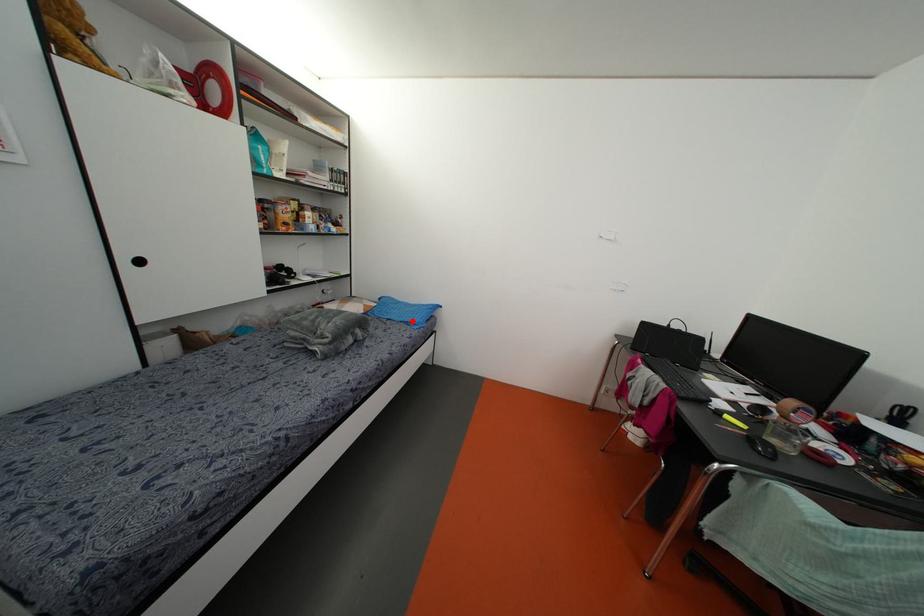
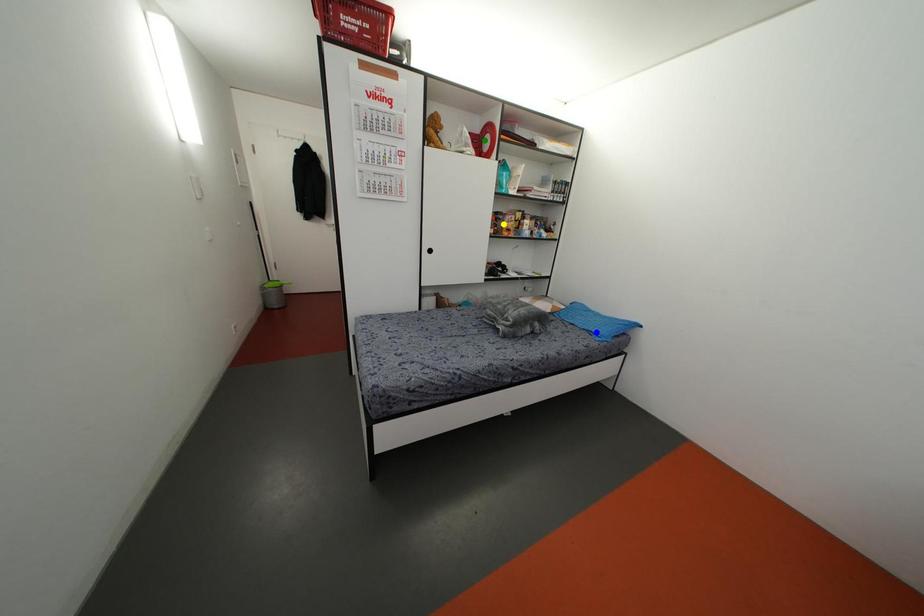
Question: I am providing you with two images of the same scene from different viewpoints. A red point is marked on the first image. You are given multiple points on the second image. Which mark in image 2 goes with the point in image 1?

Choices:
 (A) yellow point
 (B) blue point
 (C) green point

Answer: (B)